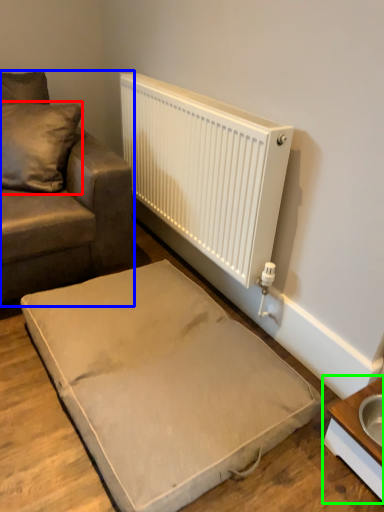
Question: Based on their relative distances, which object is nearer to pillow (highlighted by a red box)? Choose from studio couch (highlighted by a blue box) and table (highlighted by a green box).

Choices:
 (A) studio couch
 (B) table

Answer: (A)